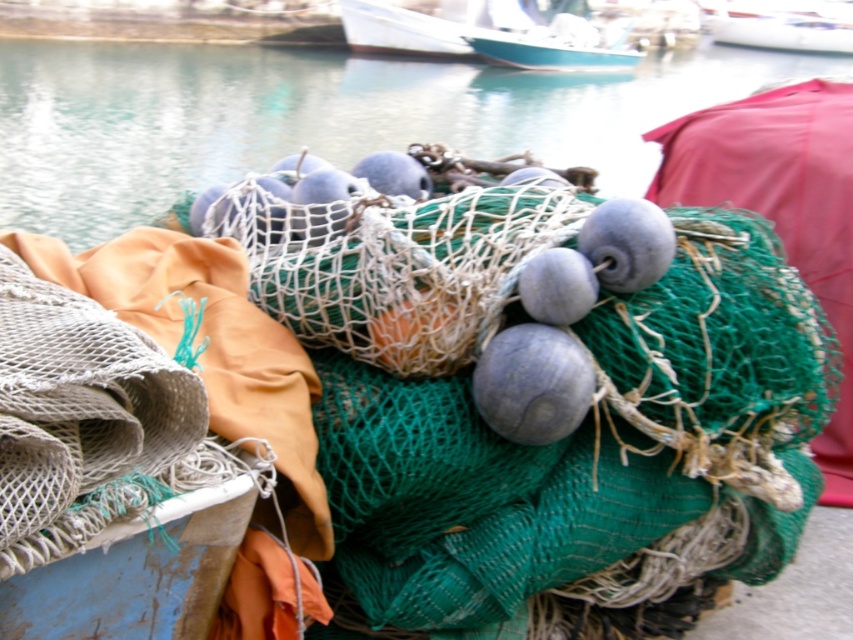
You are standing on the dockside and see the white glossy boat at upper right and the teal glossy boat at upper center. Which boat is positioned higher in the image?

The white glossy boat at upper right is positioned higher than the teal glossy boat at upper center in the image.

You are a fisherman who needs to board the white glossy boat at upper right and the teal glossy boat at upper center. Based on their positions, which boat should you approach first from the dockside?

You should approach the teal glossy boat at upper center first because the white glossy boat at upper right is positioned to the right of it, meaning the teal glossy boat at upper center is closer to the dockside entrance.